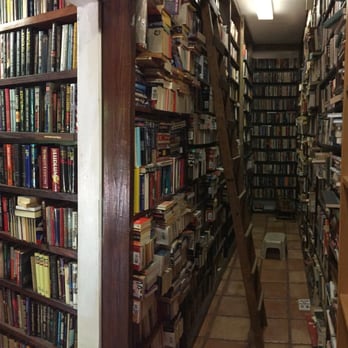
Where is `horizontal books`? This screenshot has height=348, width=348. horizontal books is located at coordinates (19, 207).